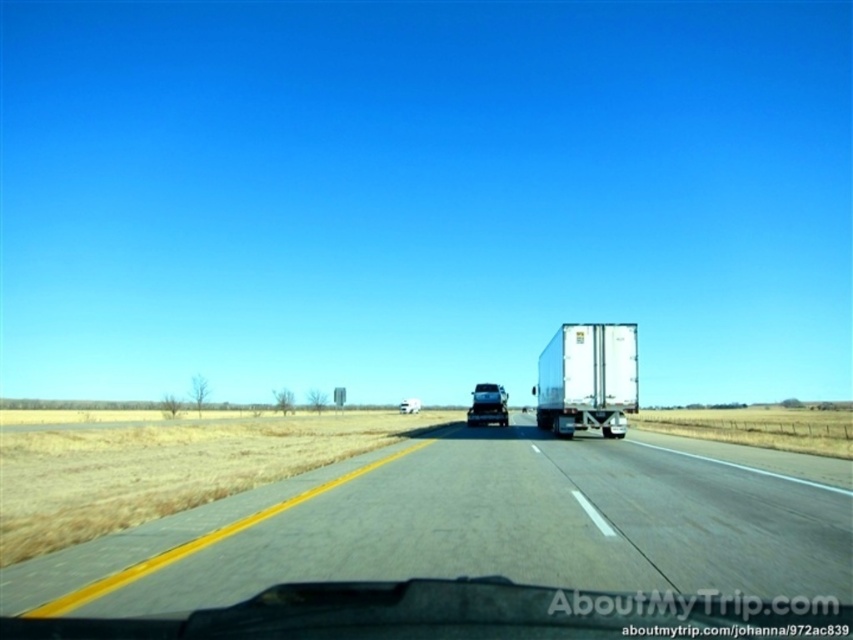
Question: Does gray asphalt highway at center appear over glossy black truck at center?

Choices:
 (A) no
 (B) yes

Answer: (B)

Question: Can you confirm if glossy black truck at center is positioned above white matte truck at center?

Choices:
 (A) yes
 (B) no

Answer: (A)

Question: Can you confirm if glossy black truck at center is positioned to the right of white matte truck at center?

Choices:
 (A) no
 (B) yes

Answer: (B)

Question: Which point is closer to the camera?

Choices:
 (A) gray asphalt highway at center
 (B) glossy black truck at center
 (C) white glossy trailer truck at center

Answer: (A)

Question: Based on their relative distances, which object is farther from the white glossy trailer truck at center?

Choices:
 (A) white matte truck at center
 (B) glossy black truck at center

Answer: (A)

Question: Which object is the farthest from the white matte truck at center?

Choices:
 (A) glossy black truck at center
 (B) white glossy trailer truck at center
 (C) gray asphalt highway at center

Answer: (C)